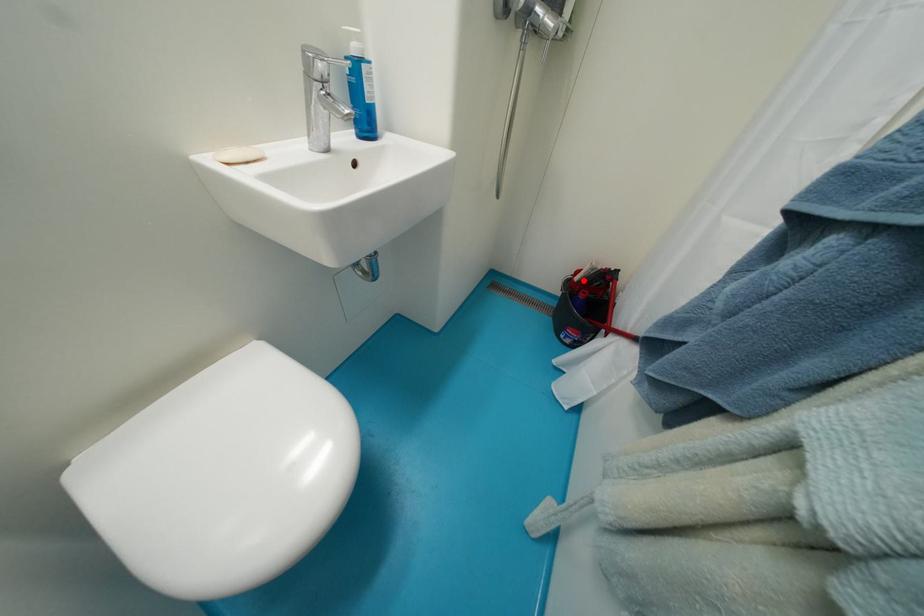
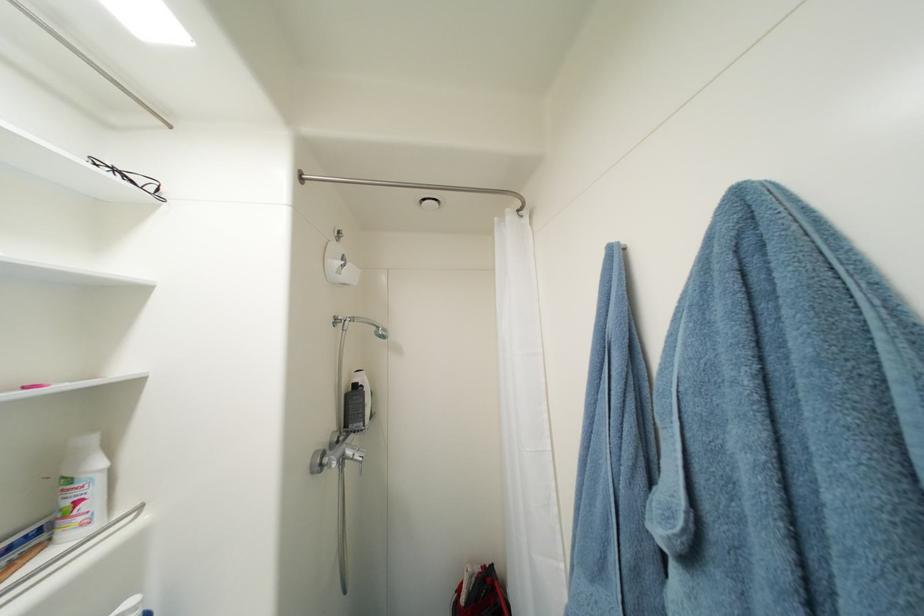
Where in the second image is the point corresponding to the highlighted location from the first image?

(469, 602)